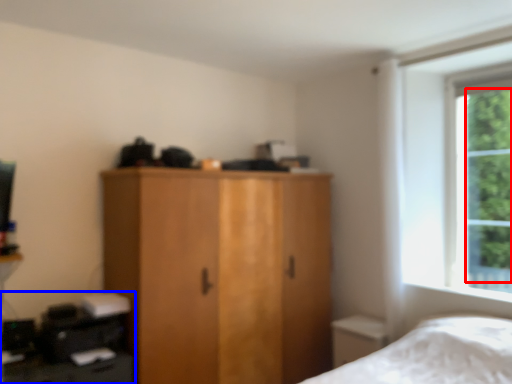
Question: Which point is closer to the camera, tree (highlighted by a red box) or computer desk (highlighted by a blue box)?

Choices:
 (A) tree
 (B) computer desk

Answer: (B)